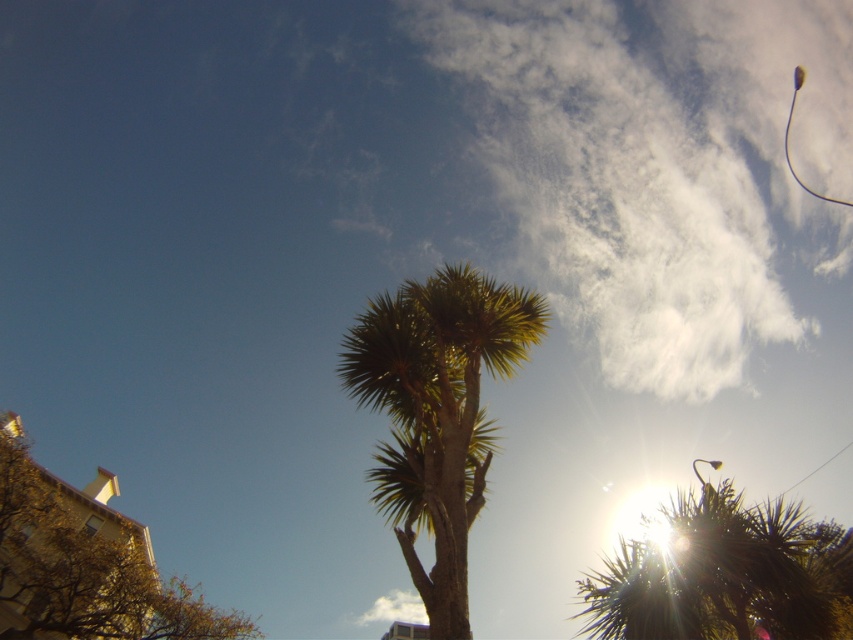
Who is taller, green leafy palm tree at center or brown textured tree at lower left?

Standing taller between the two is brown textured tree at lower left.

Between point (425, 508) and point (178, 604), which one is positioned in front?

Point (425, 508) is more forward.

At what (x,y) coordinates should I click in order to perform the action: click on green leafy palm tree at center. Please return your answer as a coordinate pair (x, y). This screenshot has height=640, width=853. Looking at the image, I should click on (437, 413).

Consider the image. Between white fluffy cloud at upper center and green spiky tree at center, which one appears on the right side from the viewer's perspective?

Positioned to the right is white fluffy cloud at upper center.

Does white fluffy cloud at upper center have a greater width compared to green spiky tree at center?

Correct, the width of white fluffy cloud at upper center exceeds that of green spiky tree at center.

Which is in front, point (718, 160) or point (821, 556)?

Point (821, 556) is in front.

Find the location of `white fluffy cloud at upper center`. white fluffy cloud at upper center is located at coordinates (659, 164).

Is point (432, 497) positioned in front of point (822, 605)?

Yes, it is.

Does green leafy palm tree at center lie in front of green spiky tree at center?

No.

This screenshot has height=640, width=853. I want to click on green leafy palm tree at center, so click(437, 413).